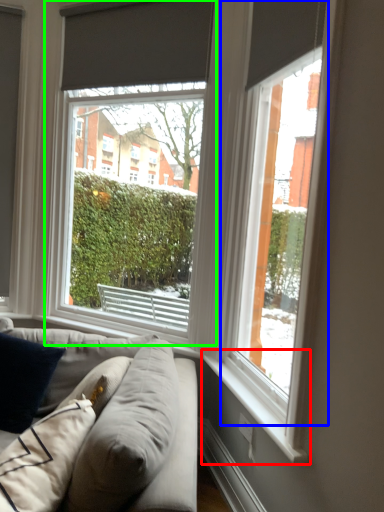
Question: Estimate the real-world distances between objects in this image. Which object is farther from window sill (highlighted by a red box), window (highlighted by a blue box) or window (highlighted by a green box)?

Choices:
 (A) window
 (B) window

Answer: (B)